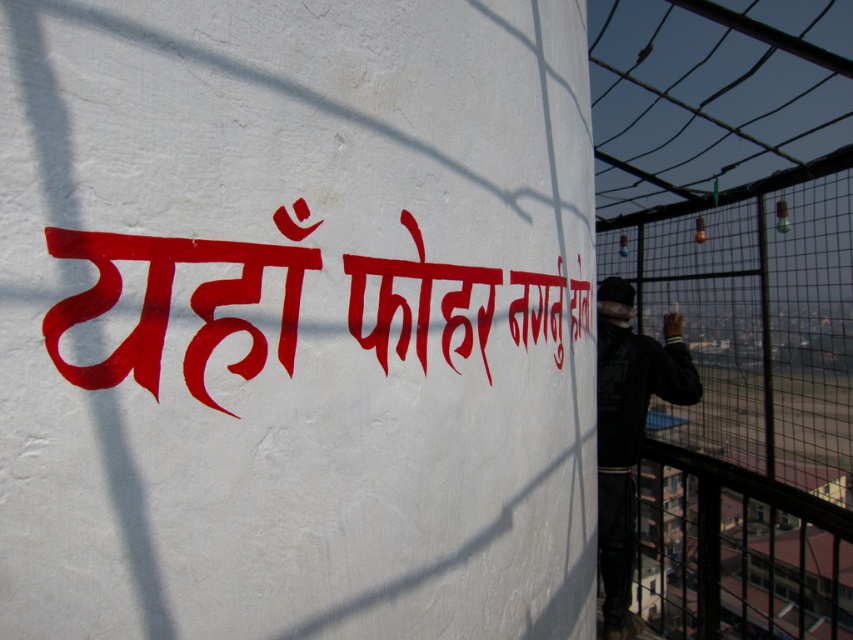
Question: Considering the relative positions of red painted text at center and dark blue jacket at right in the image provided, where is red painted text at center located with respect to dark blue jacket at right?

Choices:
 (A) above
 (B) below

Answer: (A)

Question: Estimate the real-world distances between objects in this image. Which object is closer to the red painted text at center?

Choices:
 (A) dark blue jacket at right
 (B) black metal fence at right

Answer: (A)

Question: Does red painted text at center appear under dark blue jacket at right?

Choices:
 (A) yes
 (B) no

Answer: (B)

Question: Can you confirm if black metal fence at right is positioned to the left of red painted text at center?

Choices:
 (A) yes
 (B) no

Answer: (B)

Question: Which of the following is the closest to the observer?

Choices:
 (A) (647, 259)
 (B) (491, 321)
 (C) (683, 356)

Answer: (B)

Question: Considering the real-world distances, which object is closest to the black metal fence at right?

Choices:
 (A) red painted text at center
 (B) dark blue jacket at right

Answer: (B)